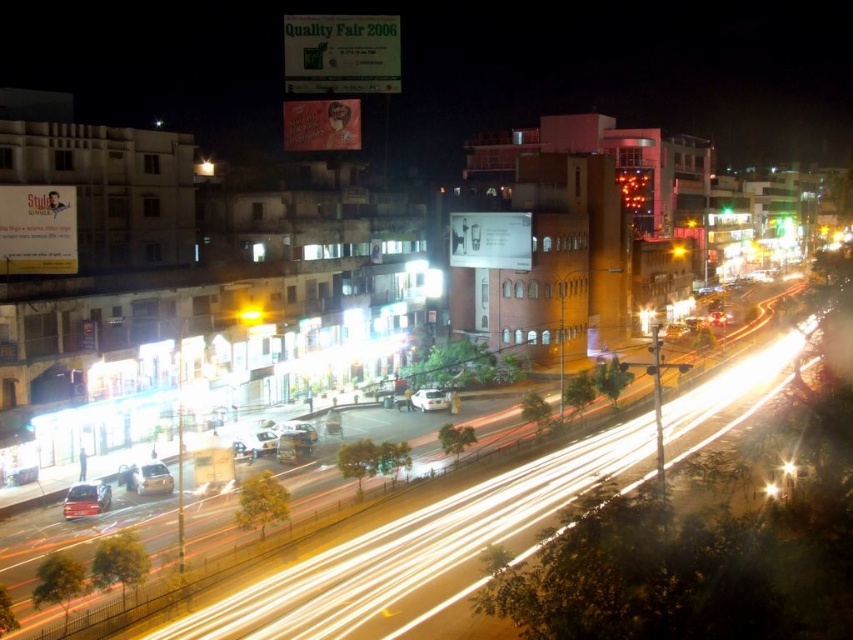
Question: Can you confirm if gold metallic car at lower left is positioned to the right of yellow glass light at center?

Choices:
 (A) no
 (B) yes

Answer: (A)

Question: Does gold metallic car at lower left appear under yellow glass light at center?

Choices:
 (A) yes
 (B) no

Answer: (A)

Question: Based on their relative distances, which object is farther from the gold metallic car at lower left?

Choices:
 (A) yellow glass light at center
 (B) white matte car at center

Answer: (B)

Question: Estimate the real-world distances between objects in this image. Which object is closer to the yellow glass light at center?

Choices:
 (A) metallic silver car at lower left
 (B) white matte car at center

Answer: (B)

Question: Does metallic silver car at lower left have a larger size compared to gold metallic car at lower left?

Choices:
 (A) no
 (B) yes

Answer: (B)

Question: Which object is the farthest from the metallic silver car at lower left?

Choices:
 (A) yellow glass light at center
 (B) gold metallic car at lower left
 (C) white matte car at center

Answer: (C)